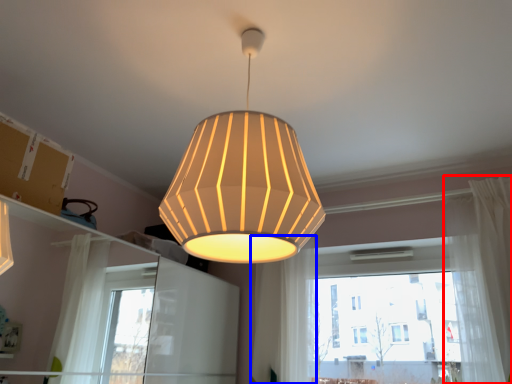
Question: Which object is further to the camera taking this photo, curtain (highlighted by a red box) or curtain (highlighted by a blue box)?

Choices:
 (A) curtain
 (B) curtain

Answer: (B)